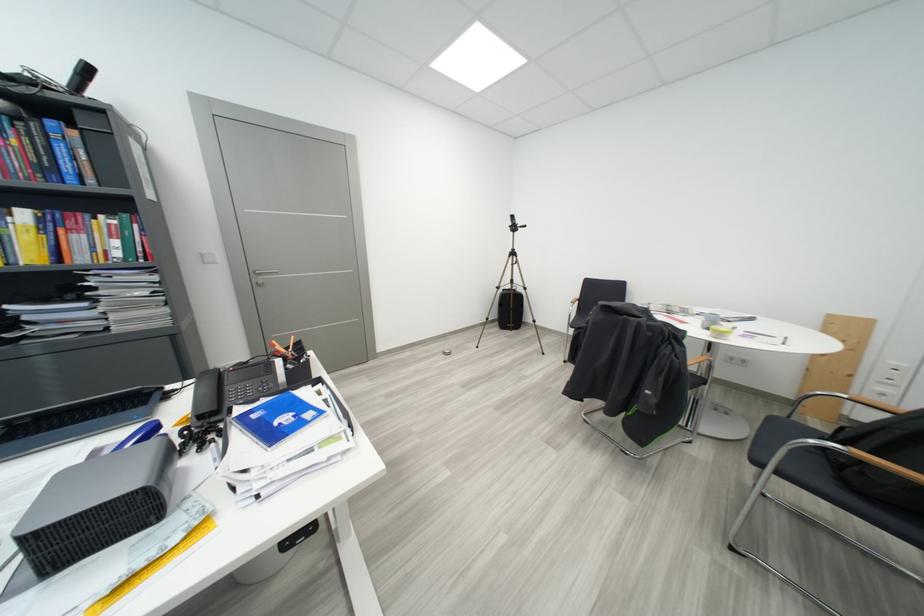
Where would you lift the telephone handset? Please return your answer as a coordinate pair (x, y).

(203, 413)